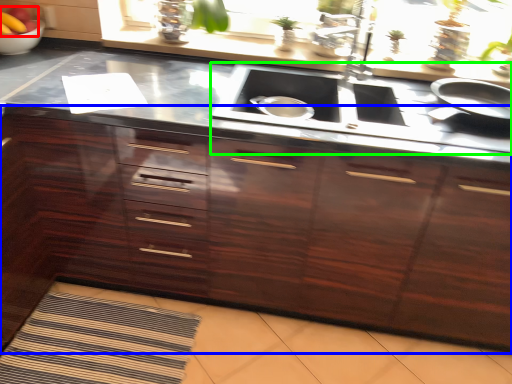
Question: Based on their relative distances, which object is farther from fruit (highlighted by a red box)? Choose from cabinetry (highlighted by a blue box) and stove (highlighted by a green box).

Choices:
 (A) cabinetry
 (B) stove

Answer: (B)